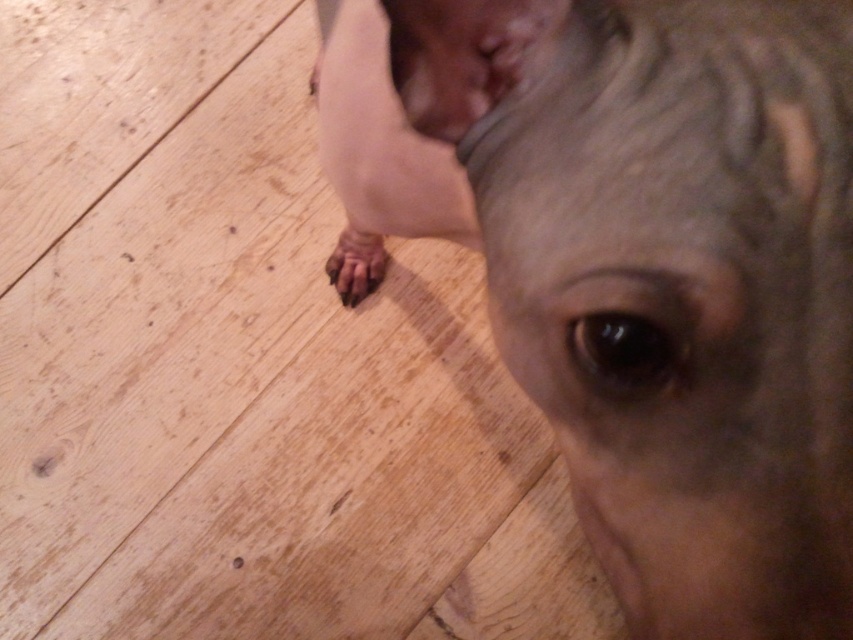
You are standing in the room where the dog is. You see two points marked on the floor. The first point is at position point (698, 17), and the second is at point (354, 301). Which point is closer to you?

Point (698, 17) is in front of point (354, 301), so it is closer to you.

You are a dog groomer assessing the size of the gray matte dog at center and the brown rough fur at lower center. Which one is larger?

The gray matte dog at center is bigger than the brown rough fur at lower center.